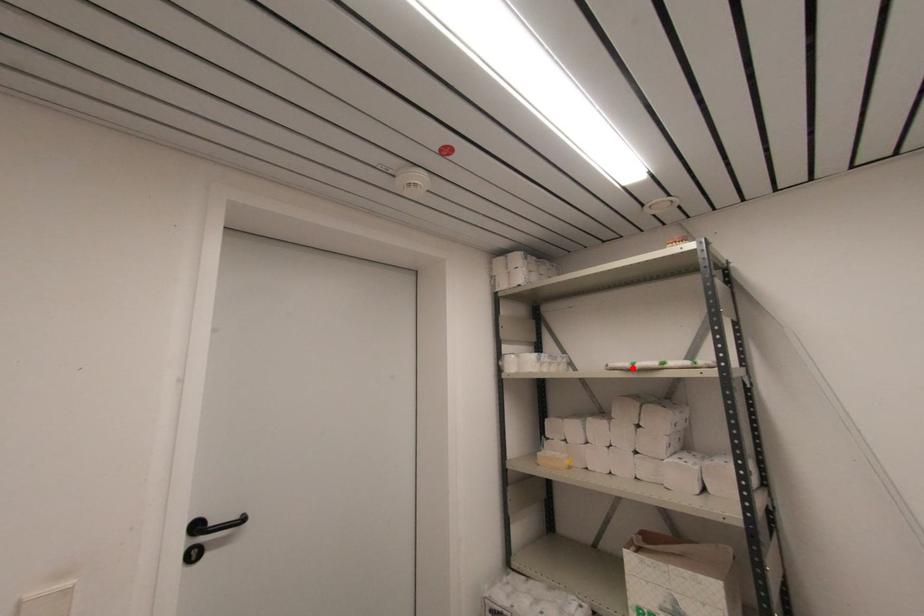
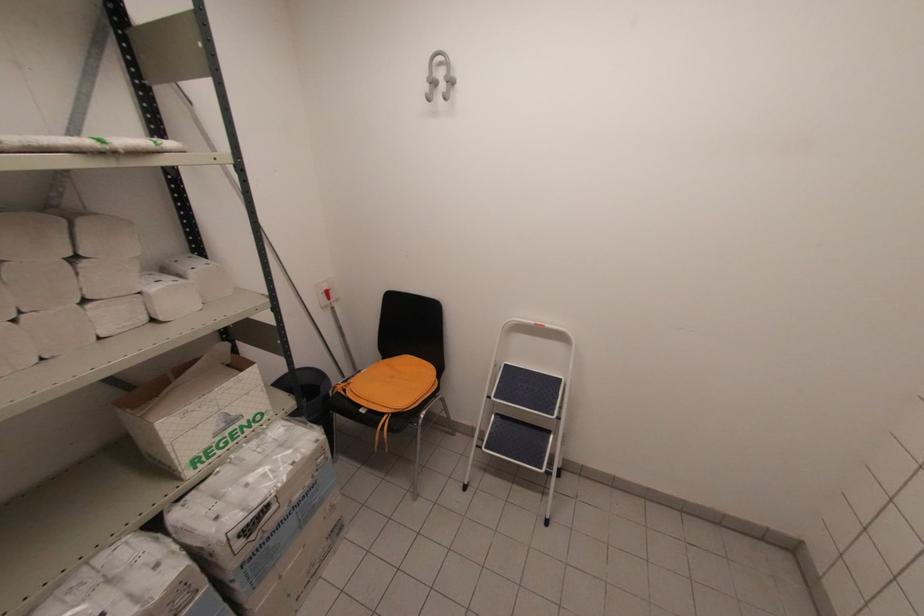
Question: I am providing you with two images of the same scene from different viewpoints. A red point is marked on the first image. Can you still see the location of the red point in image 2?

Choices:
 (A) Yes
 (B) No

Answer: (A)